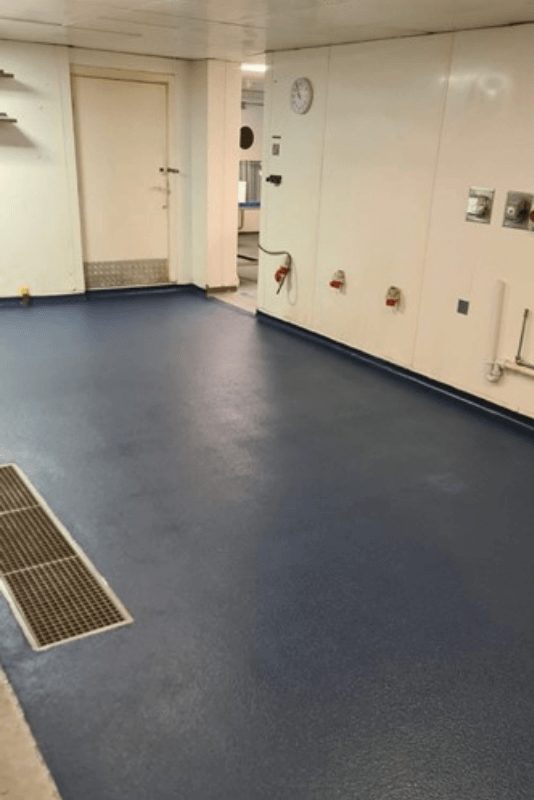
You are a GUI agent. You are given a task and a screenshot of the screen. Output one action in this format:
    pyautogui.click(x=<x>, y=<y>)
    Task: Click on the clock
    The height and width of the screenshot is (800, 534).
    Given the screenshot: What is the action you would take?
    pyautogui.click(x=297, y=102)